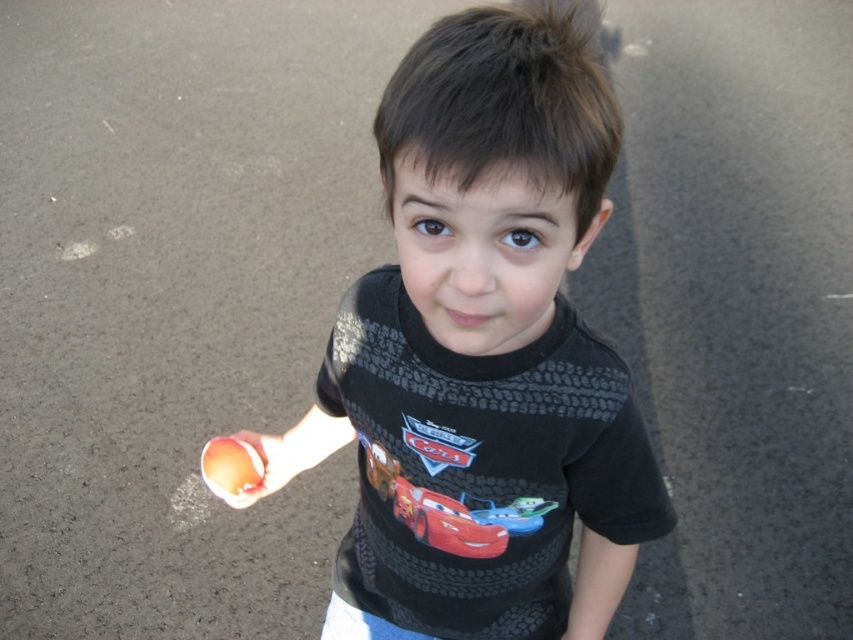
Does point (419, 140) come behind point (418, 532)?

No, (419, 140) is in front of (418, 532).

Can you confirm if black matte shirt at center is smaller than shiny red toy car at center?

No, black matte shirt at center is not smaller than shiny red toy car at center.

Which is in front, point (585, 420) or point (431, 528)?

Point (585, 420) is in front.

In order to click on black matte shirt at center in this screenshot , I will do `click(486, 346)`.

In the scene shown: How far apart are black matte shirt at center and smooth orange ball at lower left?

black matte shirt at center is 12.68 inches away from smooth orange ball at lower left.

Looking at this image, is black matte shirt at center shorter than smooth orange ball at lower left?

No, black matte shirt at center is not shorter than smooth orange ball at lower left.

Does point (608, 611) lie behind point (263, 467)?

No, it is in front of (263, 467).

What are the coordinates of `black matte shirt at center` in the screenshot? It's located at (486, 346).

Does shiny red toy car at center appear over smooth peach at lower left?

Actually, shiny red toy car at center is below smooth peach at lower left.

Which is below, shiny red toy car at center or smooth peach at lower left?

Positioned lower is shiny red toy car at center.

In the scene shown: Measure the distance between shiny red toy car at center and camera.

shiny red toy car at center and camera are 88.59 centimeters apart.

The image size is (853, 640). What are the coordinates of `shiny red toy car at center` in the screenshot? It's located at (444, 522).